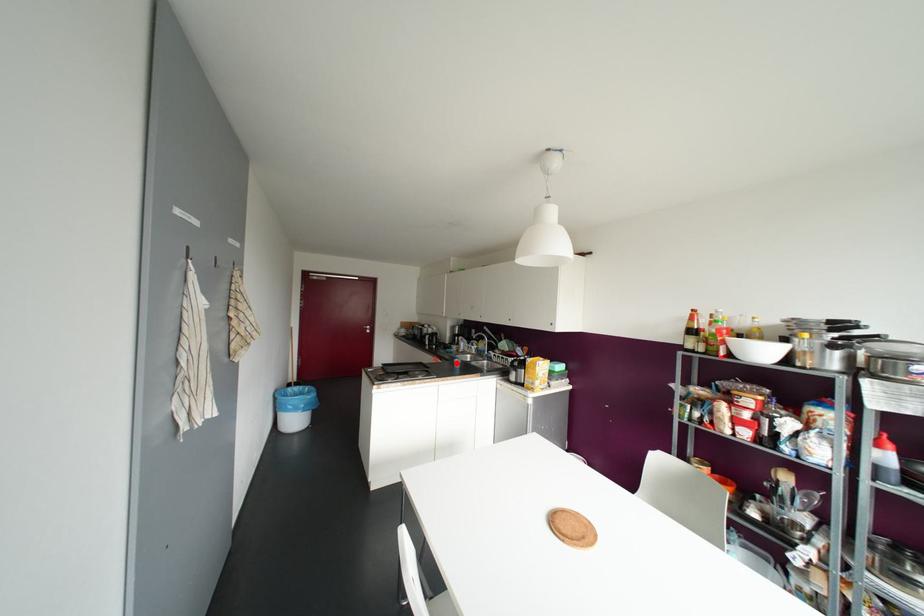
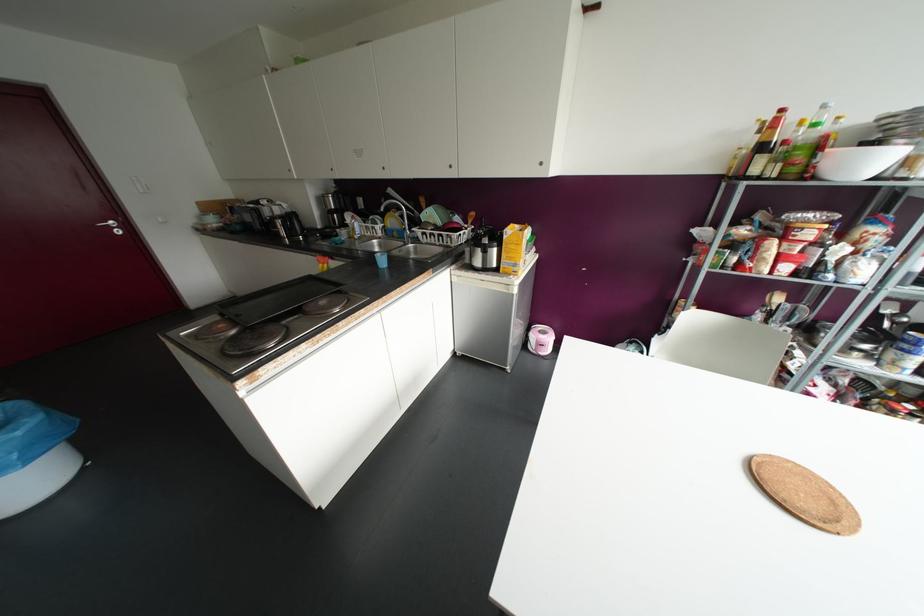
In the second image, find the point that corresponds to the highlighted location in the first image.

(382, 261)